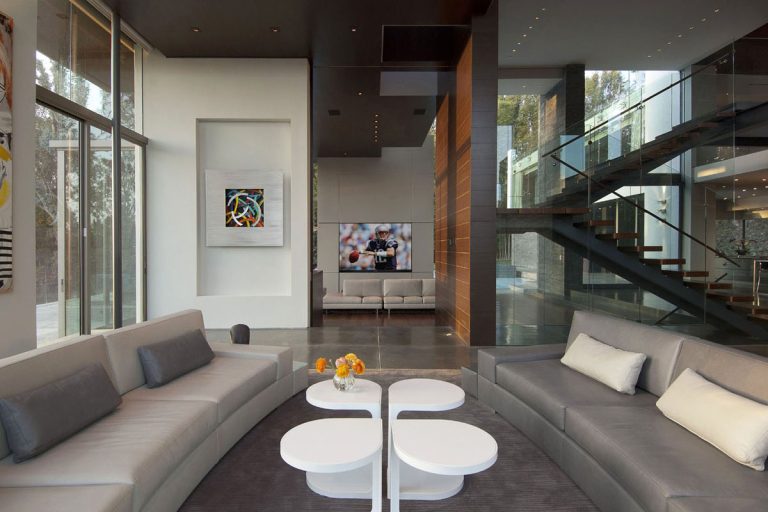
You are a GUI agent. You are given a task and a screenshot of the screen. Output one action in this format:
    pyautogui.click(x=<x>, y=<y>)
    Task: Click on the television
    
    Given the screenshot: What is the action you would take?
    pyautogui.click(x=379, y=236)